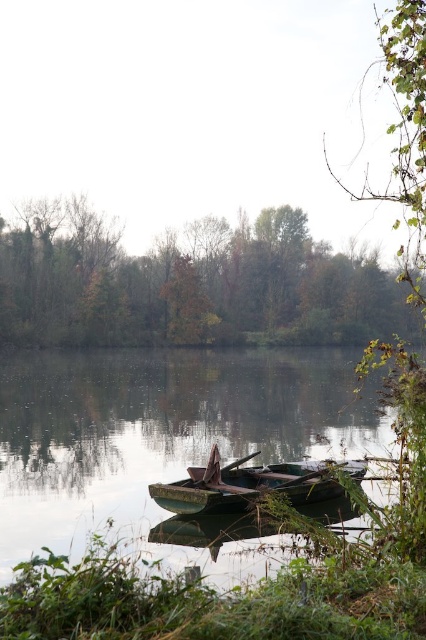
Based on the scene description, where is the green leafy tree at upper center located in the image?

The green leafy tree at upper center is located at point (189, 284).

You are an artist sketching the lakeside scene. You notice two green leafy elements in the upper part of your drawing. Which one is closer to you, the green leafy tree at upper center or the green leafy branch at upper right?

The green leafy tree at upper center is closer to you because the green leafy branch at upper right is positioned behind it.

You are a photographer standing at the lakeside. You want to capture a photo that includes both the green leafy branch at upper right and the rusty metal boat at center. Given their distance apart, can you fit both into your camera frame without moving your position?

The green leafy branch at upper right and the rusty metal boat at center are 23.45 meters apart. Since the camera frame can typically accommodate such a distance when capturing wide landscapes, both objects can be included in the photo without moving your position.